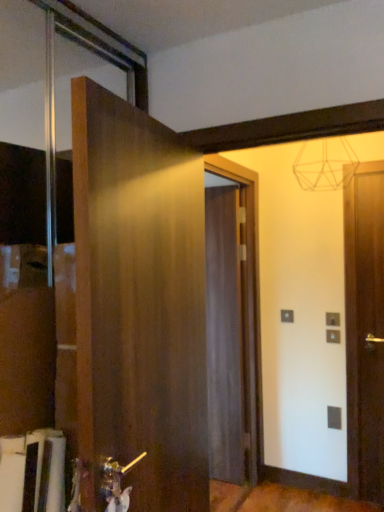
Question: Looking at the image, does matte wood door at center, the 2th door in the front-to-back sequence, seem bigger or smaller compared to wooden door at left, the second door from the right?

Choices:
 (A) big
 (B) small

Answer: (B)

Question: From a real-world perspective, relative to wooden door at left, the 1th door when ordered from left to right, is matte wood door at center, which is the 2th door from left to right, vertically above or below?

Choices:
 (A) above
 (B) below

Answer: (B)

Question: Is point (233, 364) positioned closer to the camera than point (112, 287)?

Choices:
 (A) closer
 (B) farther

Answer: (B)

Question: Is wooden door at left, the 1th door when ordered from left to right, bigger or smaller than matte wood door at center, the 2th door in the front-to-back sequence?

Choices:
 (A) big
 (B) small

Answer: (A)

Question: Is wooden door at left, the second door from the right, to the left or to the right of matte wood door at center, which is the 2th door from left to right, in the image?

Choices:
 (A) right
 (B) left

Answer: (B)

Question: Is wooden door at left, positioned as the 2th door in back-to-front order, inside the boundaries of matte wood door at center, which is the 1th door in right-to-left order, or outside?

Choices:
 (A) inside
 (B) outside

Answer: (B)

Question: From a real-world perspective, is wooden door at left, the second door from the right, physically located above or below matte wood door at center, which ranks as the first door in back-to-front order?

Choices:
 (A) below
 (B) above

Answer: (B)